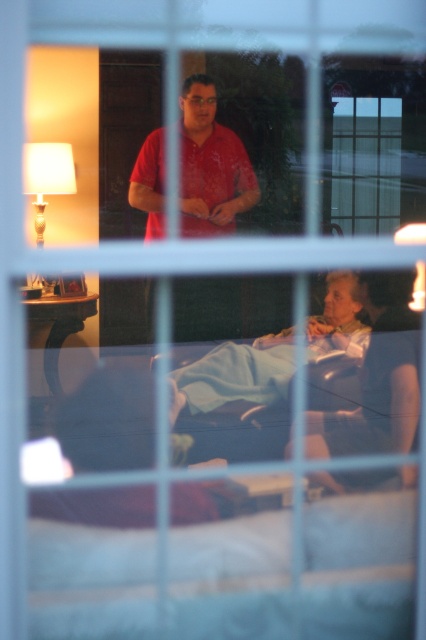
Which is more to the left, matte red shirt at center or light blue fabric at lower right?

matte red shirt at center is more to the left.

Identify the location of matte red shirt at center. Image resolution: width=426 pixels, height=640 pixels. (210, 164).

Consider the image. Does matte red shirt at center appear on the left side of light blue fabric at lower center?

Indeed, matte red shirt at center is positioned on the left side of light blue fabric at lower center.

Can you confirm if matte red shirt at center is smaller than light blue fabric at lower center?

Actually, matte red shirt at center might be larger than light blue fabric at lower center.

Is point (175, 324) less distant than point (270, 394)?

Yes.

Identify the location of matte red shirt at center. (210, 164).

From the picture: Is light blue fabric at lower right wider than light blue fabric at lower center?

No.

Does light blue fabric at lower right have a larger size compared to light blue fabric at lower center?

No, light blue fabric at lower right is not bigger than light blue fabric at lower center.

You are a GUI agent. You are given a task and a screenshot of the screen. Output one action in this format:
    pyautogui.click(x=<x>, y=<y>)
    Task: Click on the light blue fabric at lower right
    Image resolution: width=426 pixels, height=640 pixels.
    Given the screenshot: What is the action you would take?
    pyautogui.click(x=377, y=376)